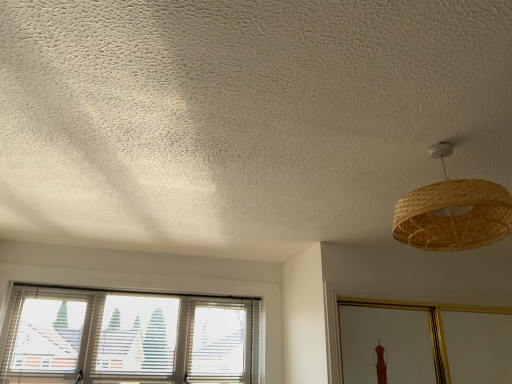
Question: From the image's perspective, is white textured blinds at lower left positioned above or below bamboo woven lampshade at upper right?

Choices:
 (A) above
 (B) below

Answer: (B)

Question: In terms of height, does white textured blinds at lower left look taller or shorter compared to bamboo woven lampshade at upper right?

Choices:
 (A) short
 (B) tall

Answer: (B)

Question: Based on their sizes in the image, would you say white textured blinds at lower left is bigger or smaller than bamboo woven lampshade at upper right?

Choices:
 (A) big
 (B) small

Answer: (A)

Question: Is bamboo woven lampshade at upper right in front of or behind white textured blinds at lower left in the image?

Choices:
 (A) front
 (B) behind

Answer: (A)

Question: Considering the positions of bamboo woven lampshade at upper right and white textured blinds at lower left in the image, is bamboo woven lampshade at upper right bigger or smaller than white textured blinds at lower left?

Choices:
 (A) big
 (B) small

Answer: (B)

Question: Is bamboo woven lampshade at upper right inside or outside of white textured blinds at lower left?

Choices:
 (A) inside
 (B) outside

Answer: (B)

Question: Is point (418, 233) closer or farther from the camera than point (15, 374)?

Choices:
 (A) closer
 (B) farther

Answer: (A)